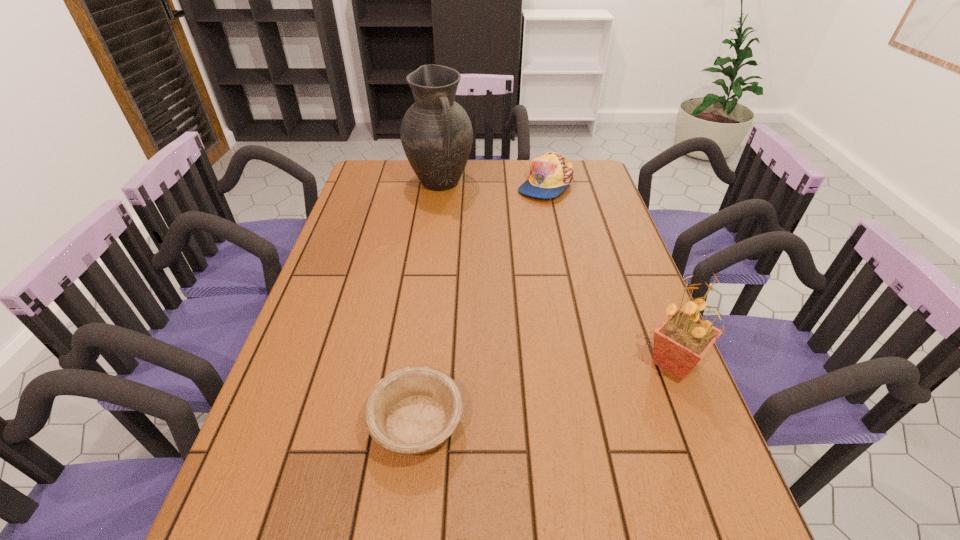
In order to click on object that is the closest to the shortest object in this screenshot , I will do `click(680, 342)`.

At what (x,y) coordinates should I click in order to perform the action: click on free space that satisfies the following two spatial constraints: 1. on the front side of the cap; 2. at the front of the sunflower with flowers visible. Please return your answer as a coordinate pair (x, y). The width and height of the screenshot is (960, 540). Looking at the image, I should click on (583, 362).

This screenshot has height=540, width=960. Identify the location of vacant position in the image that satisfies the following two spatial constraints: 1. on the front side of the cap; 2. on the left side of the pitcher. (440, 185).

Find the location of `free space that satisfies the following two spatial constraints: 1. on the back side of the shortest object; 2. on the right side of the cap`. free space that satisfies the following two spatial constraints: 1. on the back side of the shortest object; 2. on the right side of the cap is located at coordinates (444, 185).

You are a GUI agent. You are given a task and a screenshot of the screen. Output one action in this format:
    pyautogui.click(x=<x>, y=<y>)
    Task: Click on the free location that satisfies the following two spatial constraints: 1. on the back side of the bowl; 2. on the right side of the third object from left to right
    The width and height of the screenshot is (960, 540).
    Given the screenshot: What is the action you would take?
    pyautogui.click(x=444, y=185)

Identify the location of free spot that satisfies the following two spatial constraints: 1. on the back side of the bowl; 2. at the front of the second tallest object with flowers visible. Image resolution: width=960 pixels, height=540 pixels. (423, 362).